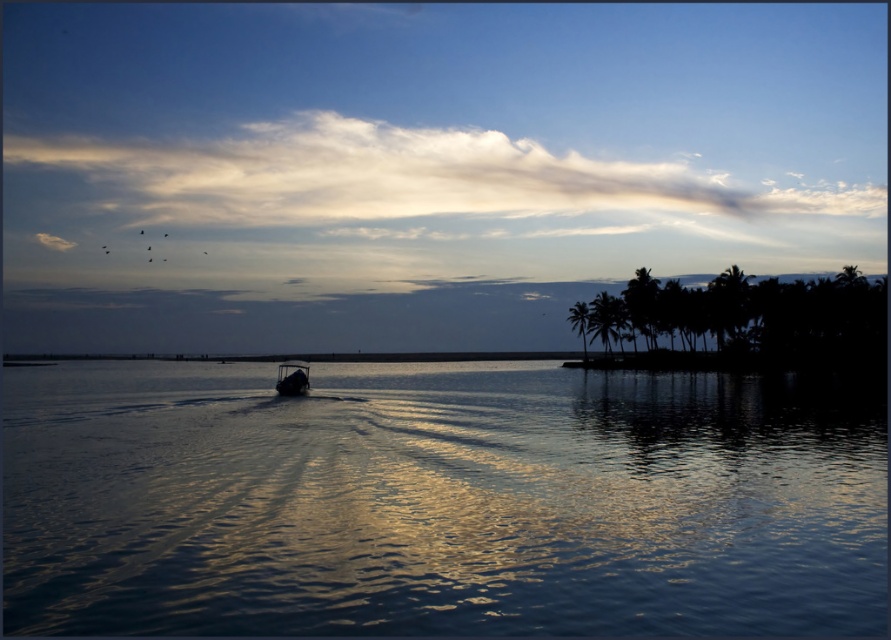
Which is more to the left, glistening blue water at center or metallic silver boat at center?

Positioned to the left is metallic silver boat at center.

Is glistening blue water at center smaller than metallic silver boat at center?

Actually, glistening blue water at center might be larger than metallic silver boat at center.

Is point (45, 417) positioned after point (307, 376)?

No, it is not.

The width and height of the screenshot is (891, 640). I want to click on glistening blue water at center, so click(x=439, y=500).